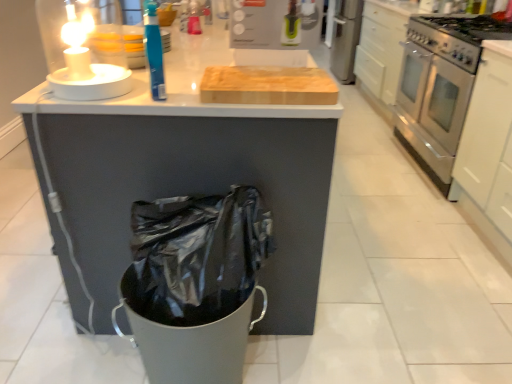
Measure the distance between point (66, 87) and camera.

Point (66, 87) and camera are 4.02 feet apart.

Where is `stainless steel gas stove at right`? stainless steel gas stove at right is located at coordinates (457, 36).

This screenshot has height=384, width=512. In order to click on white glossy drawer at upper right in this screenshot , I will do `click(381, 48)`.

Describe the element at coordinates (488, 151) in the screenshot. I see `white matte cabinet at right` at that location.

In order to face blue plastic bottle at upper center, should I rotate leftwards or rightwards?

To face it directly, rotate left by 13.355 degrees.

The image size is (512, 384). What are the coordinates of `white glossy counter at center` in the screenshot? It's located at (193, 173).

Find the location of a particular element. white glossy candle holder at upper left is located at coordinates (84, 48).

Can you tell me how much white matte cabinet at right and white glossy candle holder at upper left differ in facing direction?

179 degrees.

From a real-world perspective, between white matte cabinet at right and white glossy candle holder at upper left, who is vertically lower?

From a 3D spatial view, white matte cabinet at right is below.

The width and height of the screenshot is (512, 384). I want to click on candle holder positioned vertically above the white matte cabinet at right (from a real-world perspective), so click(84, 48).

Is white matte cabinet at right thinner than white glossy candle holder at upper left?

No, white matte cabinet at right is not thinner than white glossy candle holder at upper left.

Is the surface of white glossy candle holder at upper left in direct contact with stainless steel oven at right?

No.

Does white glossy candle holder at upper left have a larger size compared to stainless steel oven at right?

No, white glossy candle holder at upper left is not bigger than stainless steel oven at right.

Considering the points (103, 43) and (422, 77), which point is behind, point (103, 43) or point (422, 77)?

The point (422, 77) is farther from the camera.

From the image's perspective, is stainless steel gas stove at right on top of stainless steel oven at right?

Yes, from the image's perspective, stainless steel gas stove at right is above stainless steel oven at right.

Considering the relative sizes of stainless steel gas stove at right and stainless steel oven at right in the image provided, is stainless steel gas stove at right smaller than stainless steel oven at right?

Yes.

Would you consider stainless steel gas stove at right to be distant from stainless steel oven at right?

No, stainless steel gas stove at right is not far away from stainless steel oven at right.

Considering the positions of objects stainless steel gas stove at right and stainless steel oven at right in the image provided, who is more to the right, stainless steel gas stove at right or stainless steel oven at right?

stainless steel gas stove at right.

Can you confirm if stainless steel gas stove at right is positioned to the right of blue plastic bottle at upper center?

Yes, stainless steel gas stove at right is to the right of blue plastic bottle at upper center.

What's the angular difference between stainless steel gas stove at right and blue plastic bottle at upper center's facing directions?

The angular difference between stainless steel gas stove at right and blue plastic bottle at upper center is 10.6 degrees.

Find the location of a particular element. gas stove to the right of blue plastic bottle at upper center is located at coordinates (457, 36).

Between stainless steel gas stove at right and blue plastic bottle at upper center, which one has more height?

With more height is blue plastic bottle at upper center.

The height and width of the screenshot is (384, 512). Identify the location of kitchen appliance beneath the white glossy drawer at upper right (from a real-world perspective). (440, 87).

Looking at their sizes, would you say white glossy drawer at upper right is wider or thinner than stainless steel oven at right?

Clearly, white glossy drawer at upper right has more width compared to stainless steel oven at right.

Is white glossy drawer at upper right positioned with its back to stainless steel oven at right?

No, white glossy drawer at upper right is not facing the opposite direction of stainless steel oven at right.

From the picture: From the image's perspective, which one is positioned higher, white glossy drawer at upper right or stainless steel oven at right?

A: white glossy drawer at upper right appears higher in the image.

From a real-world perspective, between white glossy candle holder at upper left and stainless steel gas stove at right, who is vertically lower?

stainless steel gas stove at right is physically lower.

Is white glossy candle holder at upper left inside or outside of stainless steel gas stove at right?

white glossy candle holder at upper left is not enclosed by stainless steel gas stove at right.

Is white glossy candle holder at upper left at the left side of stainless steel gas stove at right?

Yes.

Is white glossy counter at center facing towards white matte cabinet at right?

No, white glossy counter at center is not facing towards white matte cabinet at right.

Is white glossy counter at center in contact with white matte cabinet at right?

No, white glossy counter at center is not in contact with white matte cabinet at right.

Is the position of white glossy counter at center more distant than that of white matte cabinet at right?

No, white glossy counter at center is closer to the camera.

Locate an element on the screen. cabinetry above the white glossy counter at center (from a real-world perspective) is located at coordinates (488, 151).

Locate an element on the screen. cabinetry lying below the white glossy candle holder at upper left (from the image's perspective) is located at coordinates (488, 151).

In the image, there is a white glossy candle holder at upper left. Identify the location of kitchen appliance below it (from a real-world perspective). (440, 87).

Which object lies further to the anchor point white matte cabinet at right, white glossy candle holder at upper left or white glossy drawer at upper right?

Among the two, white glossy candle holder at upper left is located further to white matte cabinet at right.

Estimate the real-world distances between objects in this image. Which object is further from stainless steel gas stove at right, white glossy drawer at upper right or white matte cabinet at right?

white glossy drawer at upper right is further to stainless steel gas stove at right.

Considering their positions, is stainless steel oven at right positioned further to stainless steel gas stove at right than white glossy drawer at upper right?

white glossy drawer at upper right is positioned further to the anchor stainless steel gas stove at right.

Based on their spatial positions, is blue plastic bottle at upper center or white glossy candle holder at upper left further from white glossy drawer at upper right?

blue plastic bottle at upper center lies further to white glossy drawer at upper right than the other object.

Based on their spatial positions, is white glossy drawer at upper right or stainless steel oven at right further from white glossy counter at center?

white glossy drawer at upper right lies further to white glossy counter at center than the other object.

Looking at the image, which one is located further to white matte cabinet at right, white glossy counter at center or stainless steel gas stove at right?

white glossy counter at center.

Which object lies further to the anchor point blue plastic bottle at upper center, white glossy candle holder at upper left or stainless steel oven at right?

stainless steel oven at right is further to blue plastic bottle at upper center.

From the image, which object appears to be farther from white glossy counter at center, white matte cabinet at right or white glossy drawer at upper right?

The object further to white glossy counter at center is white glossy drawer at upper right.

What are the coordinates of `cabinetry between white glossy counter at center and stainless steel oven at right in the horizontal direction` in the screenshot? It's located at (488, 151).

At what (x,y) coordinates should I click in order to perform the action: click on kitchen appliance between white glossy counter at center and stainless steel gas stove at right. Please return your answer as a coordinate pair (x, y). The image size is (512, 384). Looking at the image, I should click on (440, 87).

You are a GUI agent. You are given a task and a screenshot of the screen. Output one action in this format:
    pyautogui.click(x=<x>, y=<y>)
    Task: Click on the kitchen appliance situated between blue plastic bottle at upper center and stainless steel gas stove at right from left to right
    The height and width of the screenshot is (384, 512).
    Given the screenshot: What is the action you would take?
    pyautogui.click(x=440, y=87)

You are a GUI agent. You are given a task and a screenshot of the screen. Output one action in this format:
    pyautogui.click(x=<x>, y=<y>)
    Task: Click on the cabinetry located between white glossy candle holder at upper left and stainless steel oven at right in the left-right direction
    
    Given the screenshot: What is the action you would take?
    pyautogui.click(x=488, y=151)